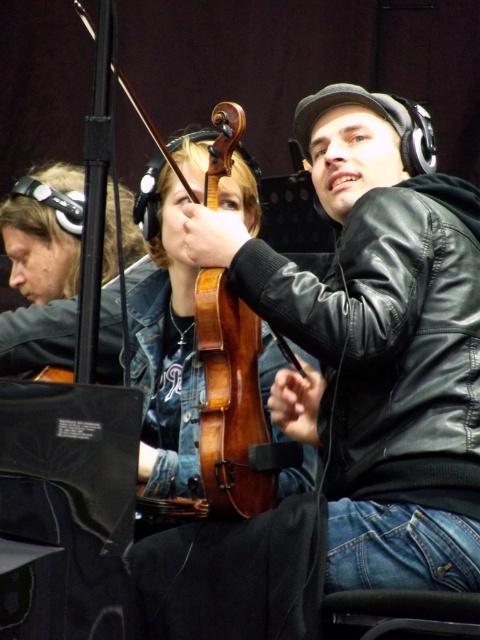
Question: Does black leather jacket at center have a larger size compared to wooden violin at center?

Choices:
 (A) no
 (B) yes

Answer: (B)

Question: Which of the following is the farthest from the observer?

Choices:
 (A) wooden violin at center
 (B) black leather jacket at center

Answer: (A)

Question: Is black leather jacket at center bigger than wooden violin at center?

Choices:
 (A) no
 (B) yes

Answer: (B)

Question: Which object appears closest to the camera in this image?

Choices:
 (A) wooden violin at center
 (B) black leather jacket at center

Answer: (B)

Question: Does black leather jacket at center have a larger size compared to wooden violin at center?

Choices:
 (A) no
 (B) yes

Answer: (B)